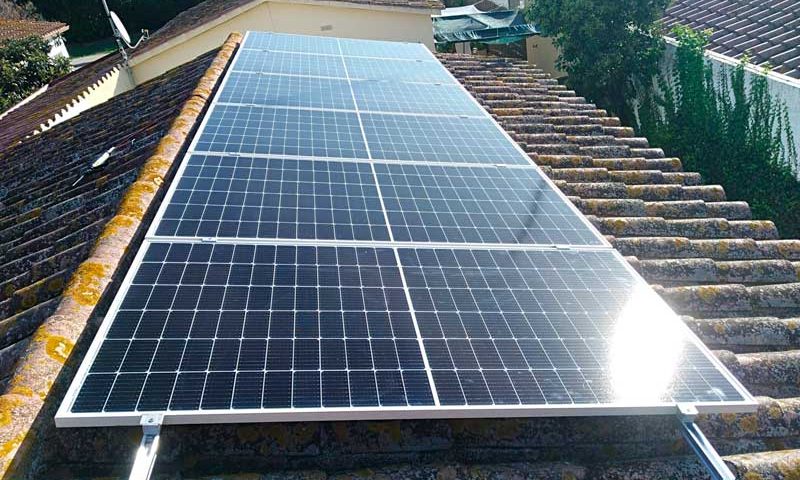
Find the location of a particular element. This screenshot has height=480, width=800. wall is located at coordinates (280, 16).